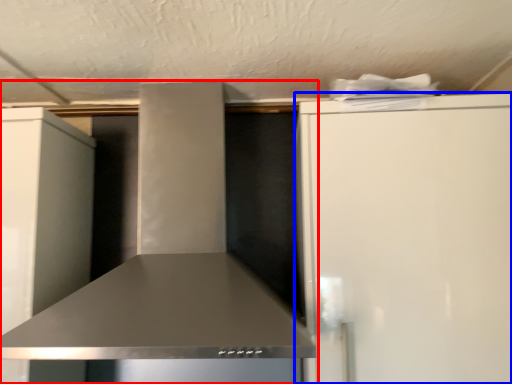
Question: Which point is closer to the camera, home appliance (highlighted by a red box) or refrigerator (highlighted by a blue box)?

Choices:
 (A) home appliance
 (B) refrigerator

Answer: (A)